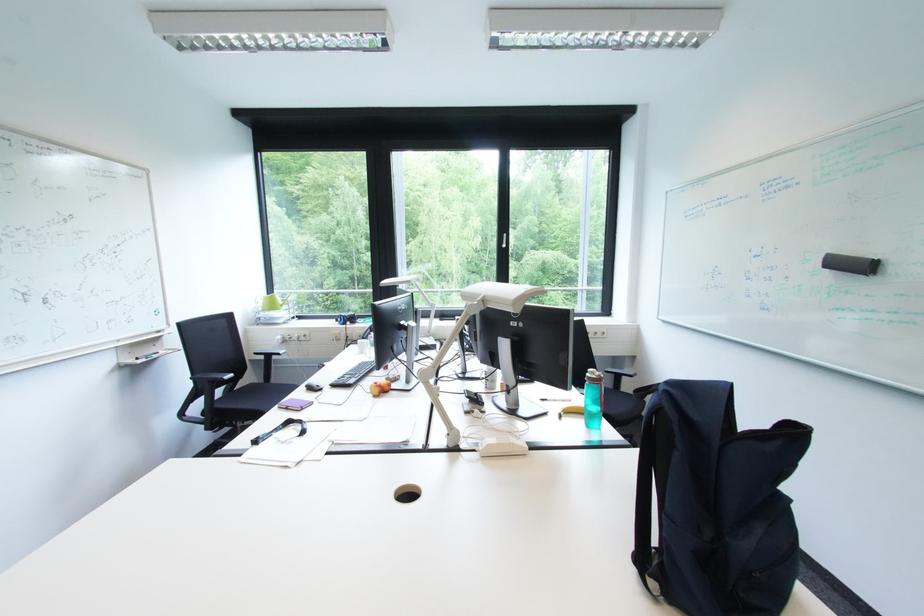
Describe the element at coordinates (273, 309) in the screenshot. The width and height of the screenshot is (924, 616). I see `the green watering can` at that location.